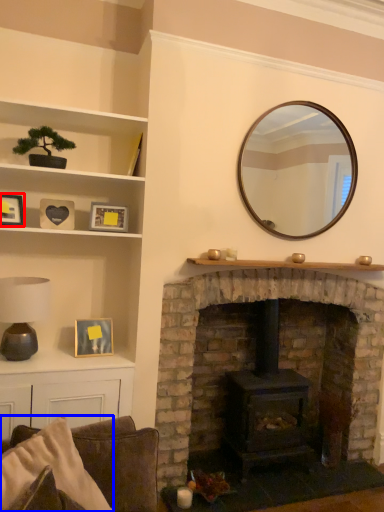
Question: Which object is further to the camera taking this photo, picture frame (highlighted by a red box) or pillow (highlighted by a blue box)?

Choices:
 (A) picture frame
 (B) pillow

Answer: (A)